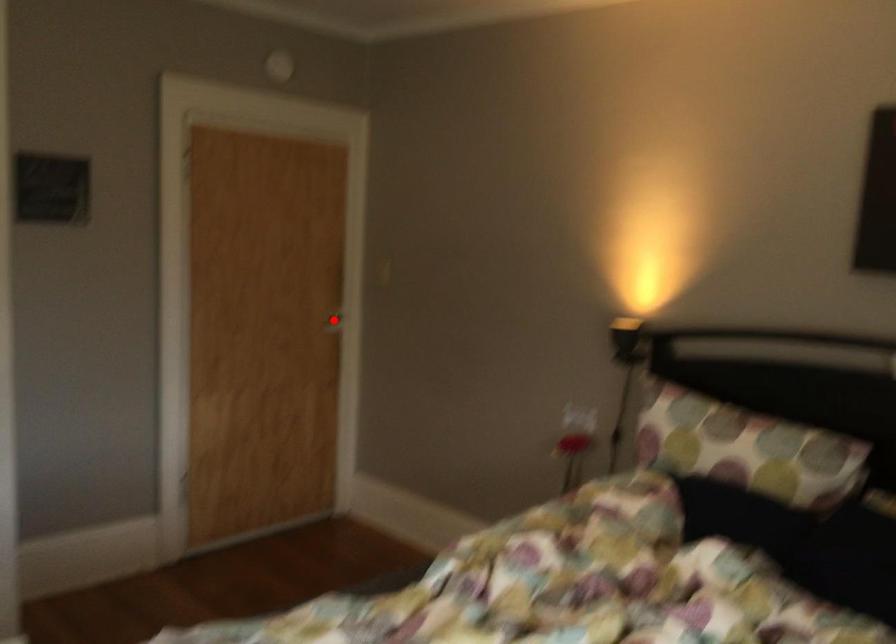
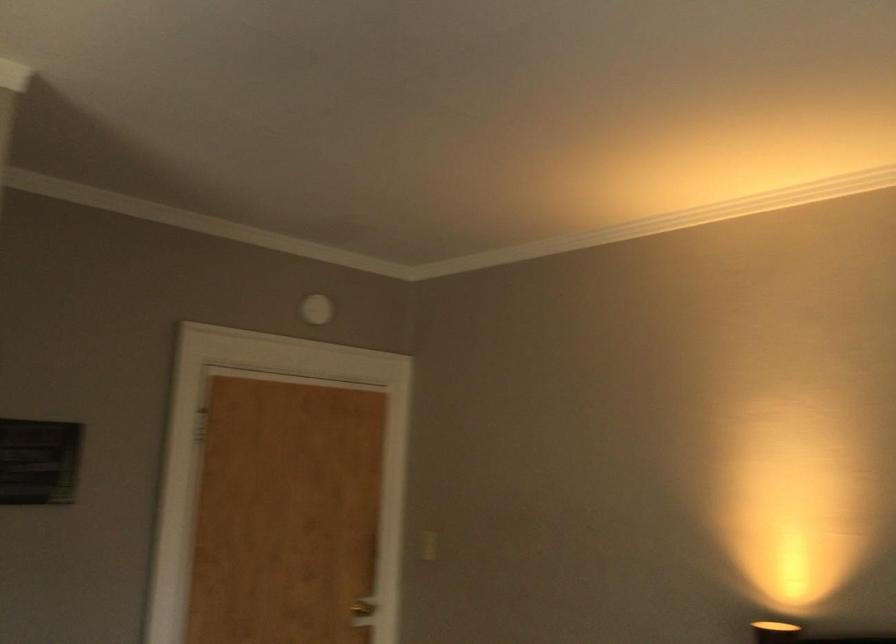
Question: I am providing you with two images of the same scene from different viewpoints. In image1, a red point is highlighted. Considering the same 3D point in image2, which of the following is correct?

Choices:
 (A) It is closer
 (B) It is farther

Answer: (A)